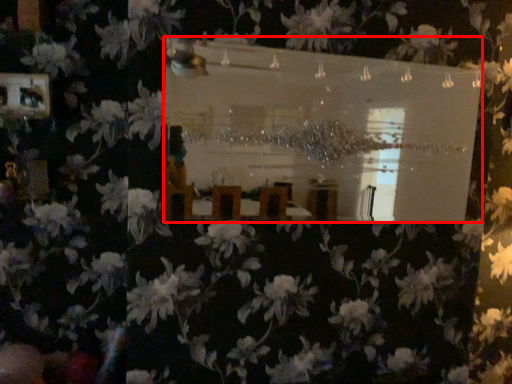
Question: From the image's perspective, where is mirror (annotated by the red box) located relative to picture frame?

Choices:
 (A) below
 (B) above

Answer: (A)